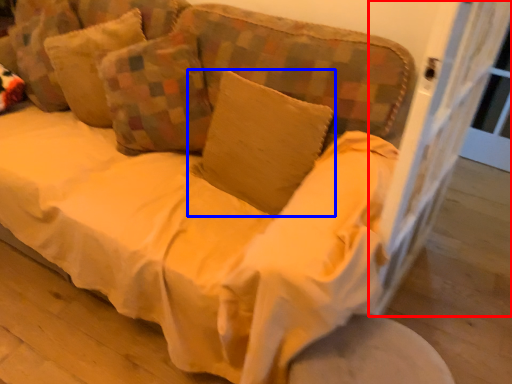
Question: Which of the following is the closest to the observer, screen door (highlighted by a red box) or pillow (highlighted by a blue box)?

Choices:
 (A) screen door
 (B) pillow

Answer: (A)